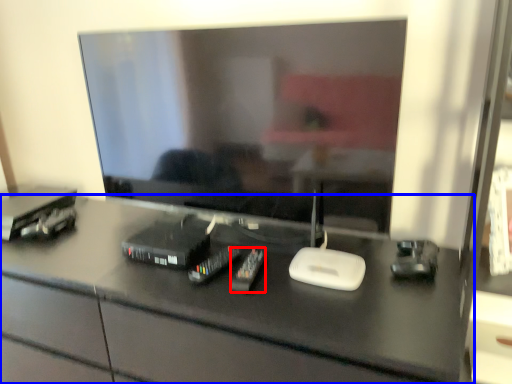
Question: Which object appears closest to the camera in this image, equipment (highlighted by a red box) or desk (highlighted by a blue box)?

Choices:
 (A) equipment
 (B) desk

Answer: (B)